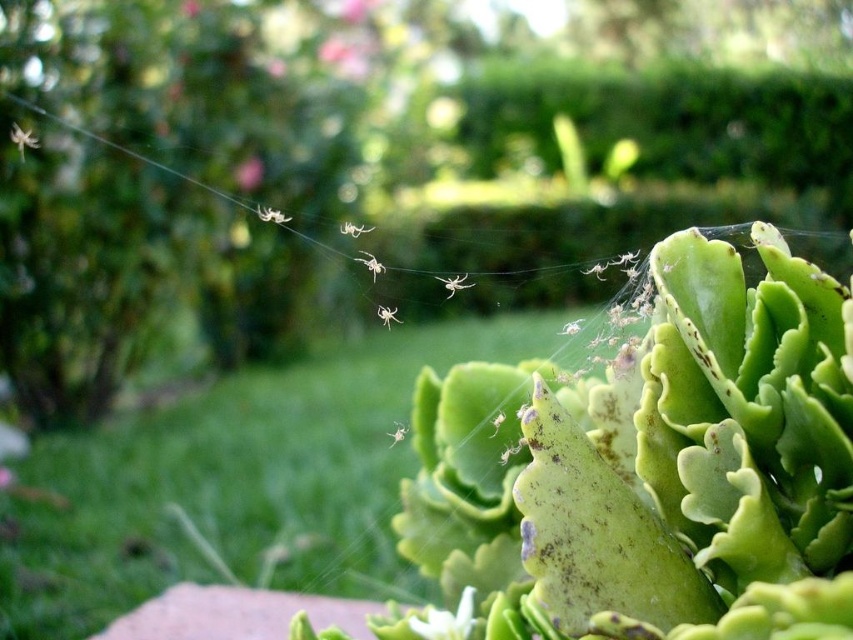
Question: Which point is closer to the camera?

Choices:
 (A) click(x=257, y=177)
 (B) click(x=103, y=440)

Answer: (B)

Question: Is pink matte flower at upper center above green matte leaf at center?

Choices:
 (A) yes
 (B) no

Answer: (A)

Question: Among these points, which one is nearest to the camera?

Choices:
 (A) [x=236, y=173]
 (B) [x=260, y=212]
 (C) [x=344, y=228]
 (D) [x=245, y=481]

Answer: (B)

Question: Is green leafy plant at lower right closer to the viewer compared to white matte spider at upper center?

Choices:
 (A) no
 (B) yes

Answer: (A)

Question: Can you confirm if pink matte flower at upper center is bigger than white matte spider at upper center?

Choices:
 (A) yes
 (B) no

Answer: (B)

Question: Which point is closer to the camera?

Choices:
 (A) green matte leaf at center
 (B) white matte spider at upper center
 (C) pink matte flower at upper center
 (D) white matte flower at lower center

Answer: (B)